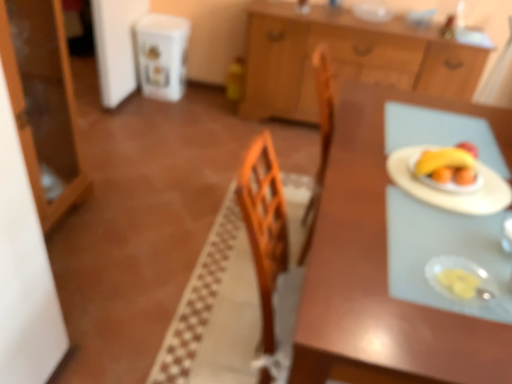
Question: Is matte wood cabinet at left, the 1th cabinetry in the front-to-back sequence, in front of or behind translucent plastic plate at right, which is the 2th tableware in back-to-front order, in the image?

Choices:
 (A) front
 (B) behind

Answer: (B)

Question: Looking at the image, does matte wood cabinet at left, the second cabinetry positioned from the right, seem bigger or smaller compared to translucent plastic plate at right, which is the 2th tableware in top-to-bottom order?

Choices:
 (A) small
 (B) big

Answer: (B)

Question: Estimate the real-world distances between objects in this image. Which object is closer to the matte wood cabinet at left, the 2th cabinetry positioned from the back?

Choices:
 (A) clear glass bowl at upper center, the first tableware viewed from the right
 (B) translucent plastic plate at right, which is the 2th tableware in back-to-front order
 (C) wooden cabinet at upper center, the 1th cabinetry in the right-to-left sequence
 (D) yellow matte bananas at right
 (E) wooden table at center

Answer: (E)

Question: Which is farther from the white paper plate at right?

Choices:
 (A) yellow matte bananas at right
 (B) wooden table at center
 (C) clear glass bowl at upper center, arranged as the first tableware when viewed from the top
 (D) wooden cabinet at upper center, which appears as the 1th cabinetry when viewed from the back
 (E) translucent plastic plate at right, which ranks as the 1th tableware in front-to-back order

Answer: (C)